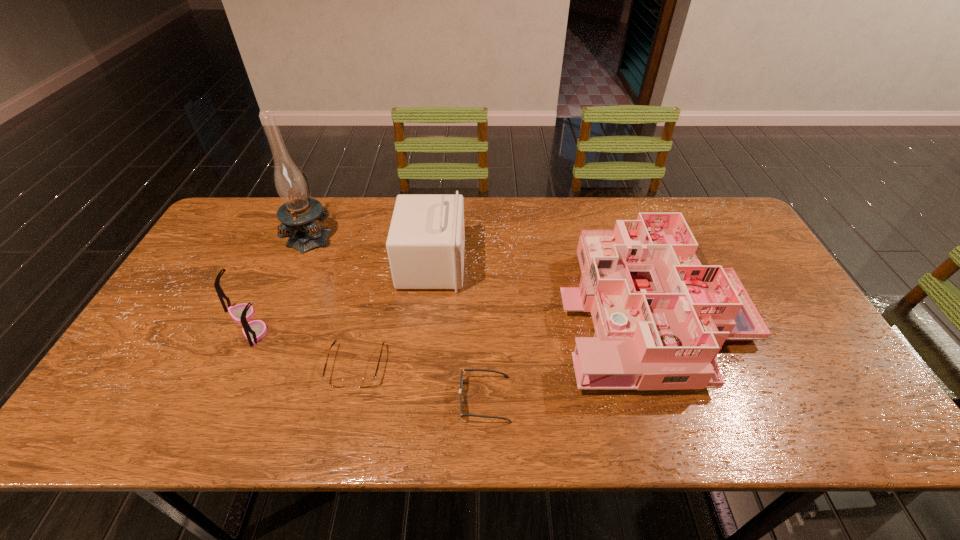
In order to click on vacant space positioned 0.150m at the front entrance of the rightmost object in this screenshot , I will do `click(506, 308)`.

Find the location of `vacant region located on the right of the tallest spectacles`. vacant region located on the right of the tallest spectacles is located at coordinates 400,324.

Locate an element on the screen. vacant area situated 0.120m on the face of the rightmost spectacles is located at coordinates (407, 399).

The height and width of the screenshot is (540, 960). In order to click on vacant area located 0.180m on the face of the rightmost spectacles in this screenshot , I will do `click(381, 399)`.

You are a GUI agent. You are given a task and a screenshot of the screen. Output one action in this format:
    pyautogui.click(x=<x>, y=<y>)
    Task: Click on the vacant region located 0.160m on the face of the rightmost spectacles
    
    Given the screenshot: What is the action you would take?
    pyautogui.click(x=390, y=399)

I want to click on free region located on the front-facing side of the second spectacles from right to left, so click(342, 430).

The image size is (960, 540). I want to click on oil lamp at the far edge, so click(x=298, y=214).

I want to click on the first-aid kit positioned at the far edge, so click(x=425, y=245).

At what (x,y) coordinates should I click in order to perform the action: click on object situated at the near edge. Please return your answer as a coordinate pair (x, y). Image resolution: width=960 pixels, height=540 pixels. Looking at the image, I should click on (462, 370).

Identify the location of object at the right edge. (660, 317).